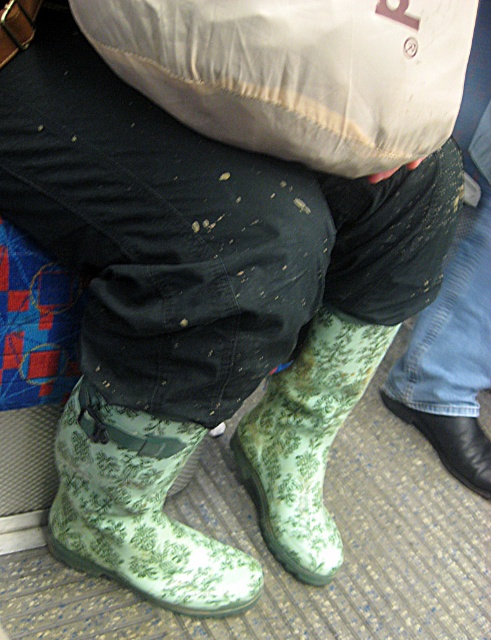
Question: Which of the following is the closest to the observer?

Choices:
 (A) white fabric sack at upper center
 (B) black leather boot at lower right
 (C) green floral rubber boot at lower center
 (D) green floral rubber boot at center

Answer: (A)

Question: Among these objects, which one is farthest from the camera?

Choices:
 (A) black leather boot at lower right
 (B) green floral rubber boot at lower center
 (C) white fabric sack at upper center

Answer: (A)

Question: Among these objects, which one is farthest from the camera?

Choices:
 (A) green floral rubber boot at center
 (B) green floral rubber boot at lower center
 (C) black leather boot at lower right
 (D) white fabric sack at upper center

Answer: (C)

Question: Can you confirm if green floral rubber boot at center is bigger than black leather boot at lower right?

Choices:
 (A) yes
 (B) no

Answer: (A)

Question: Is white fabric sack at upper center to the left of green floral rubber boot at lower center from the viewer's perspective?

Choices:
 (A) yes
 (B) no

Answer: (B)

Question: Does white fabric sack at upper center appear on the left side of green floral rubber boot at lower center?

Choices:
 (A) no
 (B) yes

Answer: (A)